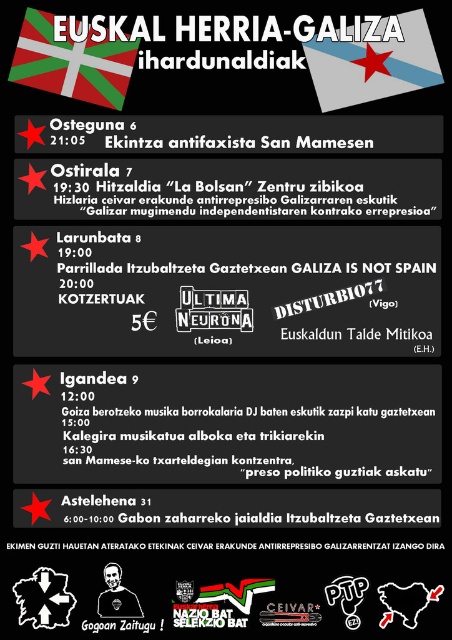
Question: Which of the following is the farthest from the observer?

Choices:
 (A) white fabric flag at upper left
 (B) black paper at center
 (C) blue fabric flag at upper center

Answer: (B)

Question: Does black paper at center appear over white fabric flag at upper left?

Choices:
 (A) yes
 (B) no

Answer: (B)

Question: Which of the following is the farthest from the observer?

Choices:
 (A) blue fabric flag at upper center
 (B) white fabric flag at upper left
 (C) black paper at center

Answer: (C)

Question: Can you confirm if blue fabric flag at upper center is bigger than white fabric flag at upper left?

Choices:
 (A) yes
 (B) no

Answer: (A)

Question: Which point is farther from the camera taking this photo?

Choices:
 (A) pyautogui.click(x=384, y=163)
 (B) pyautogui.click(x=396, y=48)
 (C) pyautogui.click(x=99, y=100)

Answer: (A)

Question: Does black paper at center appear under blue fabric flag at upper center?

Choices:
 (A) yes
 (B) no

Answer: (A)